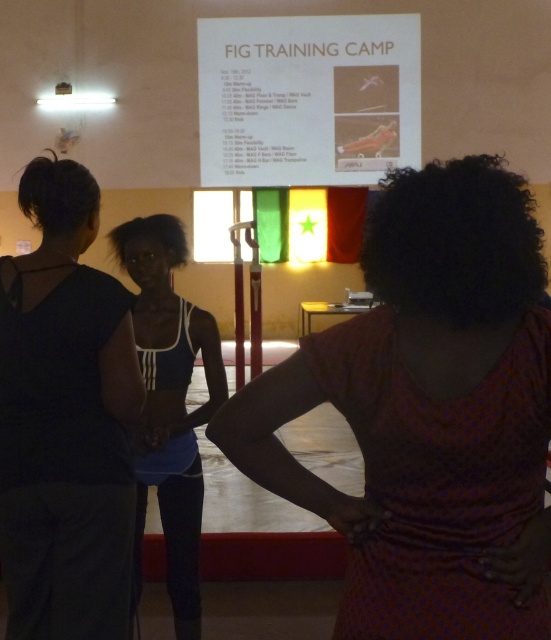
You are a photographer positioned at the center of the room. You need to capture a photo that includes both the black matte tank top at left and the white matte sports bra at center. Given that your camera has a maximum focal length that allows capturing objects up to 30 inches apart, will you be able to include both subjects in the same frame?

The black matte tank top at left is 29.91 inches away from the white matte sports bra at center. Since the distance between them is just under 30 inches, your camera can capture both subjects in the same frame.

You are organizing a display for a fashion show and need to place the printed cotton dress at center and the white paper at upper center. According to the scene, which item is shorter?

The printed cotton dress at center is shorter than the white paper at upper center.